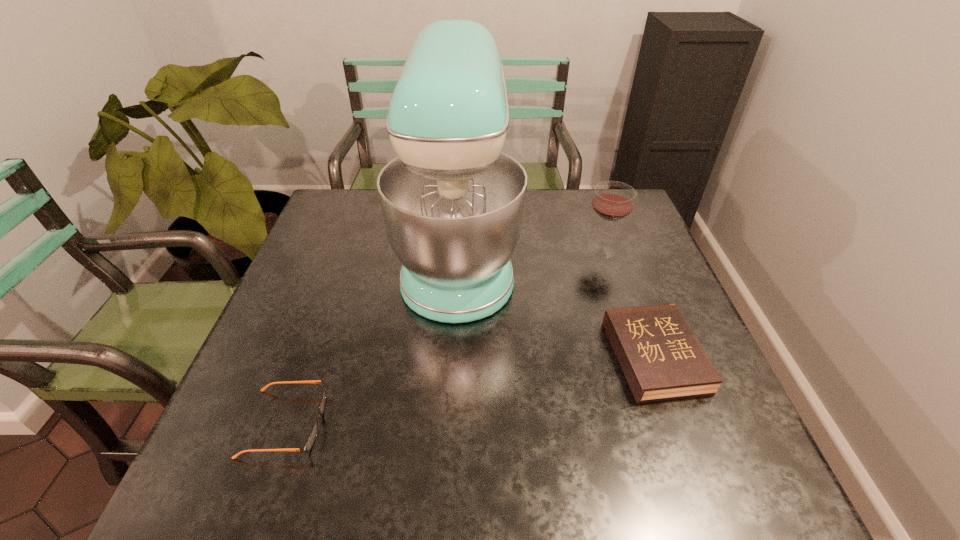
The width and height of the screenshot is (960, 540). I want to click on mixer, so click(453, 205).

Locate an element on the screen. the tallest object is located at coordinates (453, 205).

The width and height of the screenshot is (960, 540). In order to click on the second tallest object in this screenshot , I will do 612,201.

Identify the location of hardback book. (661, 358).

At what (x,y) coordinates should I click in order to perform the action: click on the leftmost object. Please return your answer as a coordinate pair (x, y). This screenshot has height=540, width=960. Looking at the image, I should click on (311, 438).

Find the location of a particular element. Image resolution: width=960 pixels, height=540 pixels. spectacles is located at coordinates (311, 438).

Locate an element on the screen. vacant space located 0.350m at the base of the tallest object is located at coordinates (642, 255).

Locate an element on the screen. free space located on the back of the wineglass is located at coordinates (589, 212).

The width and height of the screenshot is (960, 540). I want to click on vacant space situated 0.330m on the left of the hardback book, so click(x=462, y=356).

Identify the location of vacant space located 0.370m on the front-facing side of the spectacles. This screenshot has height=540, width=960. tap(516, 423).